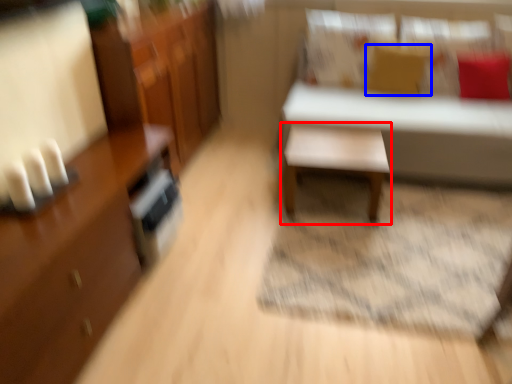
Question: Which of the following is the closest to the observer, table (highlighted by a red box) or pillow (highlighted by a blue box)?

Choices:
 (A) table
 (B) pillow

Answer: (A)